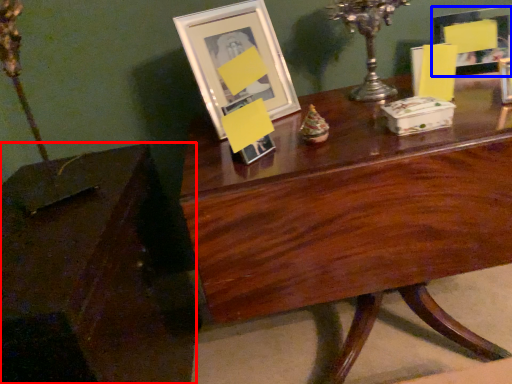
Question: Which object appears closest to the camera in this image, table (highlighted by a red box) or picture frame (highlighted by a blue box)?

Choices:
 (A) table
 (B) picture frame

Answer: (A)